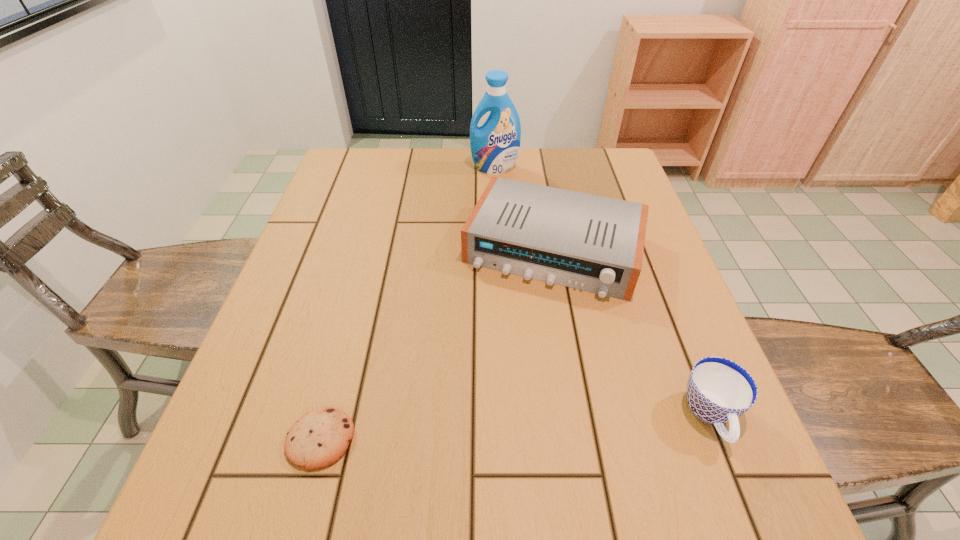
You are a GUI agent. You are given a task and a screenshot of the screen. Output one action in this format:
    pyautogui.click(x=<x>, y=<y>)
    Task: Click on the free space that is in between the cup and the leftmost object
    The width and height of the screenshot is (960, 540).
    Given the screenshot: What is the action you would take?
    pyautogui.click(x=516, y=427)

Find the location of `free space between the second tallest object and the leftmost object`. free space between the second tallest object and the leftmost object is located at coordinates tap(437, 344).

The width and height of the screenshot is (960, 540). Find the location of `vacant region between the third tallest object and the third shortest object`. vacant region between the third tallest object and the third shortest object is located at coordinates (632, 332).

Identify which object is the second closest to the cup. Please provide its 2D coordinates. Your answer should be formatted as a tuple, i.e. [(x, y)], where the tuple contains the x and y coordinates of a point satisfying the conditions above.

[(317, 440)]

Where is `the third closest object to the farthest object`? The width and height of the screenshot is (960, 540). the third closest object to the farthest object is located at coordinates (317, 440).

You are a GUI agent. You are given a task and a screenshot of the screen. Output one action in this format:
    pyautogui.click(x=<x>, y=<y>)
    Task: Click on the vacant space that satisfies the following two spatial constraints: 1. on the back side of the leftmost object; 2. on the left side of the tallest object
    Image resolution: width=960 pixels, height=540 pixels.
    Given the screenshot: What is the action you would take?
    pyautogui.click(x=393, y=167)

This screenshot has width=960, height=540. In order to click on vacant space that satisfies the following two spatial constraints: 1. on the back side of the shortest object; 2. on the left side of the farthest object in this screenshot , I will do `click(393, 167)`.